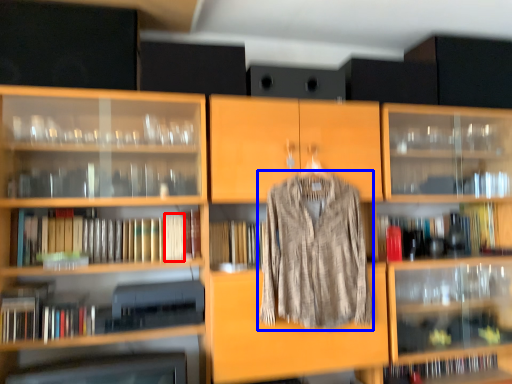
Question: Which object is closer to the camera taking this photo, book (highlighted by a red box) or clothing (highlighted by a blue box)?

Choices:
 (A) book
 (B) clothing

Answer: (B)